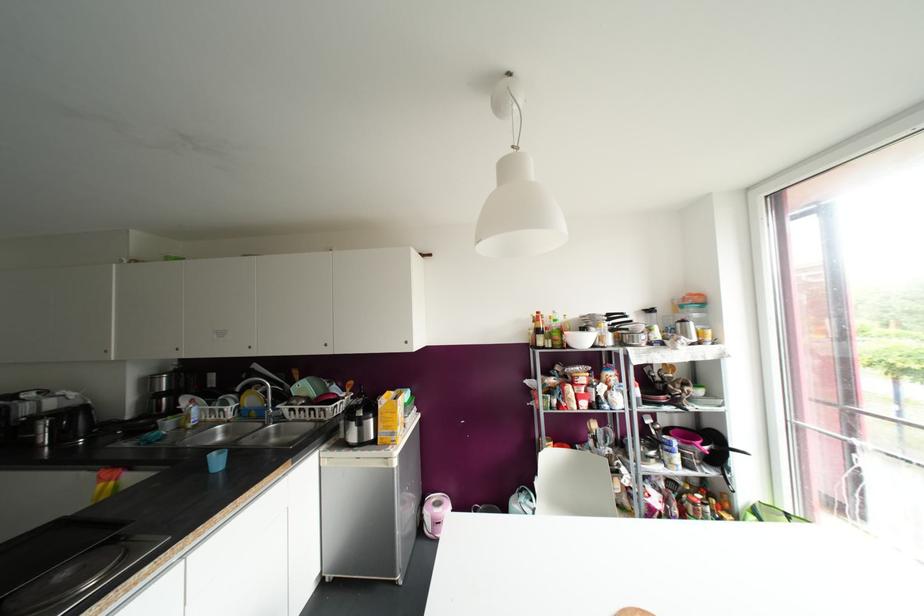
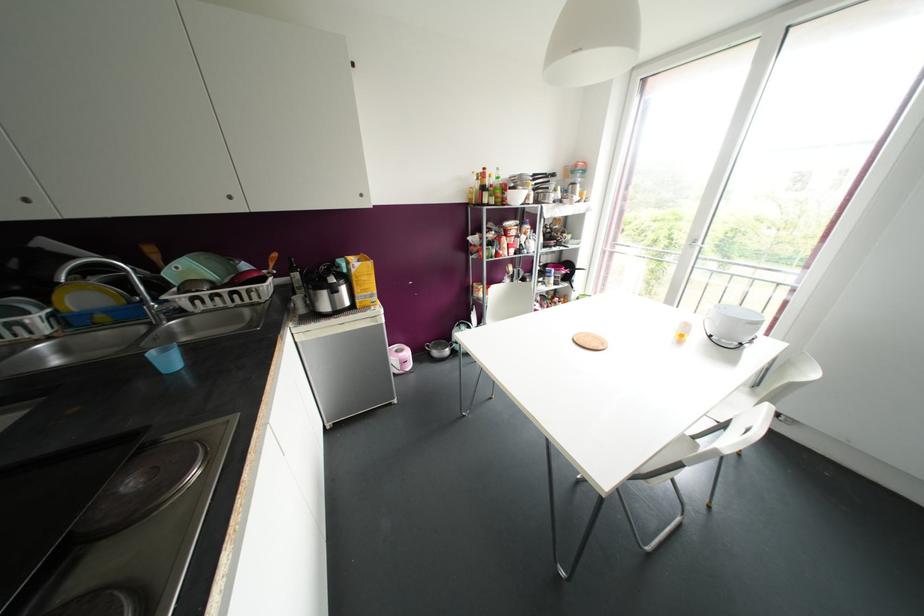
Where in the second image is the point corresponding to (x=216, y=462) from the first image?

(168, 361)